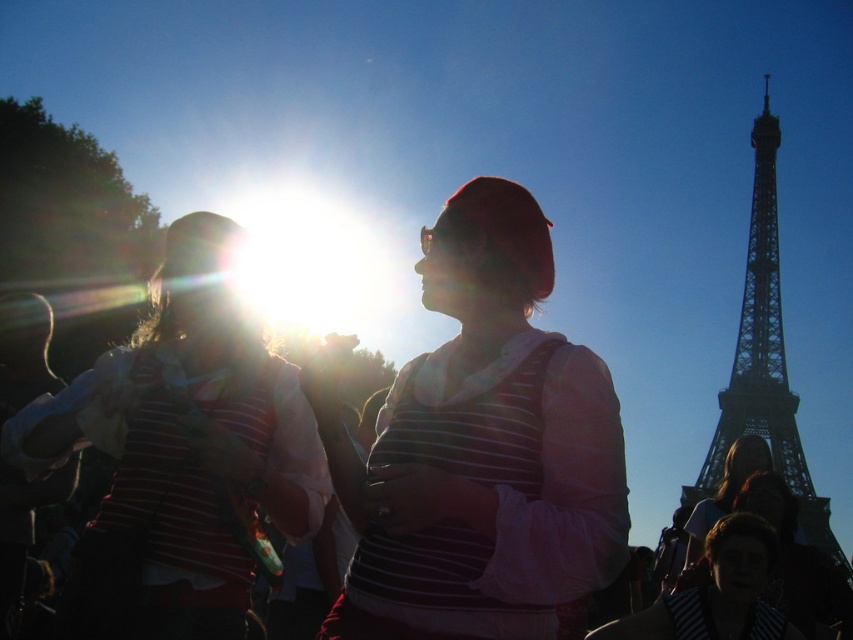
Question: Does matte striped shirt at center appear over dark gray metal eiffel tower at right?

Choices:
 (A) yes
 (B) no

Answer: (B)

Question: Does matte striped shirt at center appear under dark gray metal eiffel tower at right?

Choices:
 (A) no
 (B) yes

Answer: (B)

Question: Which point is farther to the camera?

Choices:
 (A) (532, 497)
 (B) (137, 516)
 (C) (775, 461)

Answer: (B)

Question: Which point is farther to the camera?

Choices:
 (A) (151, 563)
 (B) (363, 561)

Answer: (A)

Question: Considering the real-world distances, which object is closest to the striped fabric shirt at center?

Choices:
 (A) dark gray metal eiffel tower at right
 (B) matte striped shirt at center

Answer: (B)

Question: Is matte striped shirt at center to the left of dark gray metal eiffel tower at right from the viewer's perspective?

Choices:
 (A) yes
 (B) no

Answer: (A)